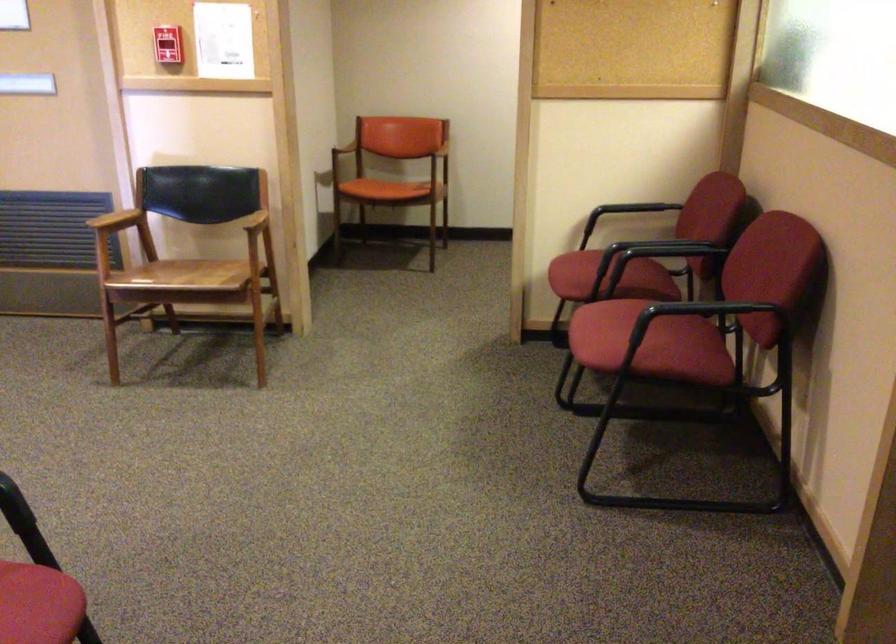
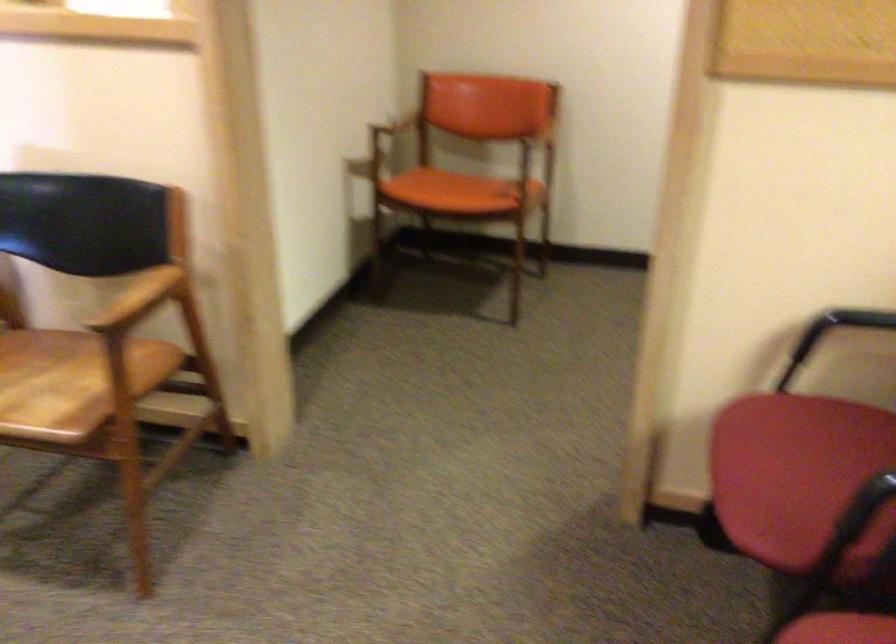
Locate, in the second image, the point that corresponds to point (582, 269) in the first image.

(798, 477)